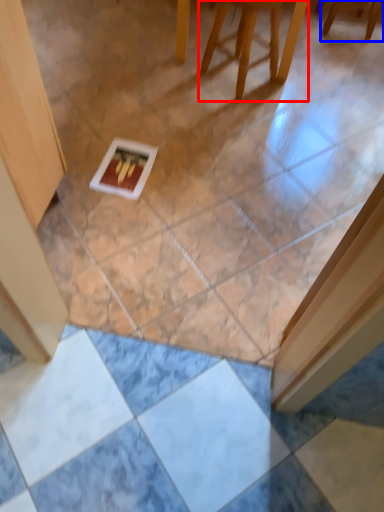
Question: Among these objects, which one is nearest to the camera, furniture (highlighted by a red box) or furniture (highlighted by a blue box)?

Choices:
 (A) furniture
 (B) furniture

Answer: (A)